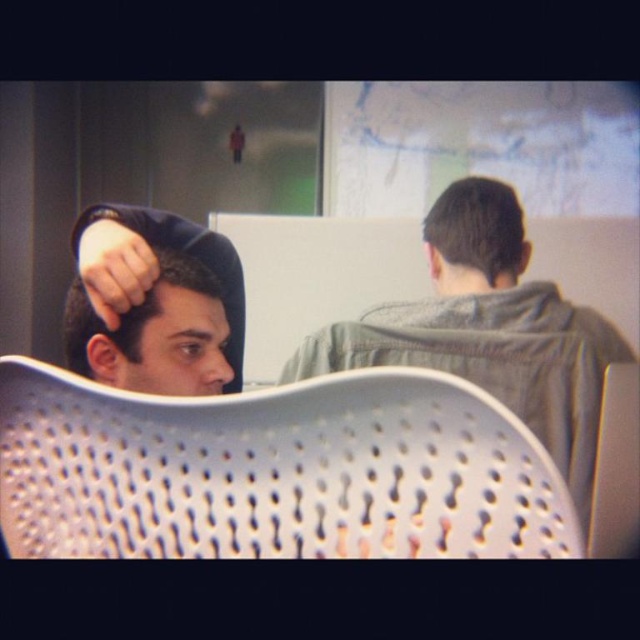
You are planning to place a new desk between the white perforated chair at center and the gray fabric jacket at upper right. Given their widths, which object should be placed closer to the desk to ensure there is enough space?

The white perforated chair at center has a smaller width than the gray fabric jacket at upper right, so placing it closer to the desk would leave more space for the wider jacket.

You are a delivery robot in an office. You need to deliver a package to the person sitting on the white perforated chair at center. There is a gray fabric jacket at upper right nearby. Can you reach the chair without moving the jacket?

The white perforated chair at center and gray fabric jacket at upper right are 75.55 centimeters apart from each other. Since the jacket is 75.55 cm away from the chair, the robot can likely navigate around it as the distance is sufficient for movement, so yes, the robot can reach the chair without moving the jacket.

You are standing in the office and want to sit on the white perforated chair at center. Can you see the point at coordinates (275, 472) on the chair?

The point at coordinates (275, 472) is located on the white perforated chair at center, so yes, you can see it there.